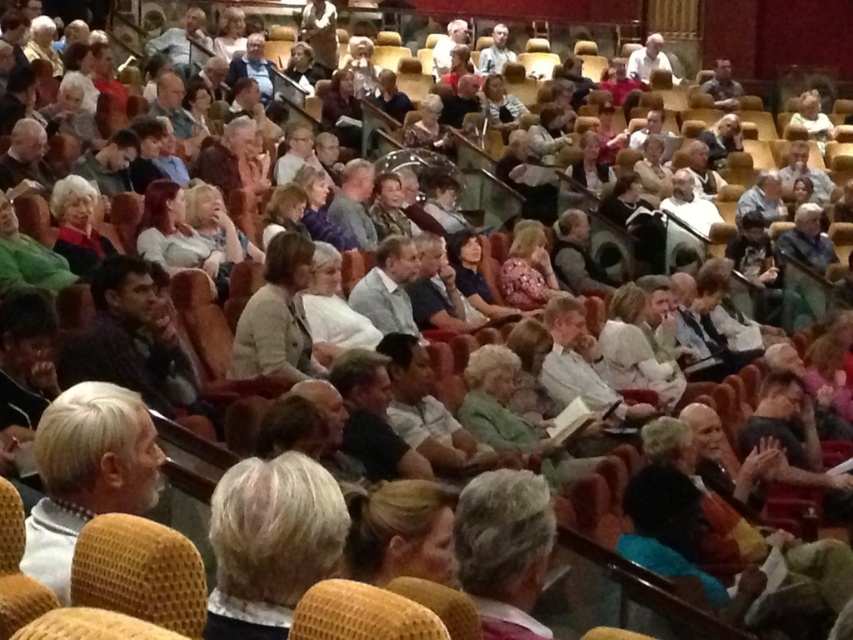
You are sitting in the front row of the auditorium and want to look at the person with blonde hair at center. According to the coordinates provided, in which direction should you look relative to your current position?

The blonde hair at center is located at coordinates point (271, 541). Since you are in the front row, you should look towards the center of the auditorium to see the person with blonde hair at center.

You are a photographer standing at the front of the auditorium and want to take a photo of the audience. You notice two elements at the center of the scene, the blonde hair at center and the light beige fabric jacket at center. Which of these two elements will appear smaller in the photo?

The blonde hair at center will appear smaller in the photo because it occupies less space than the light beige fabric jacket at center.

You are a photographer in the front row of the auditorium. You want to take a photo of the person with the blonde hair at center and the light beige fabric jacket at center. However, you notice that the angle might block part of them. Based on their positions, which part of the person will be more visible in your photo?

The light beige fabric jacket at center will be more visible because the blonde hair at center is positioned under it, so the jacket is above the hair and less likely to be blocked.